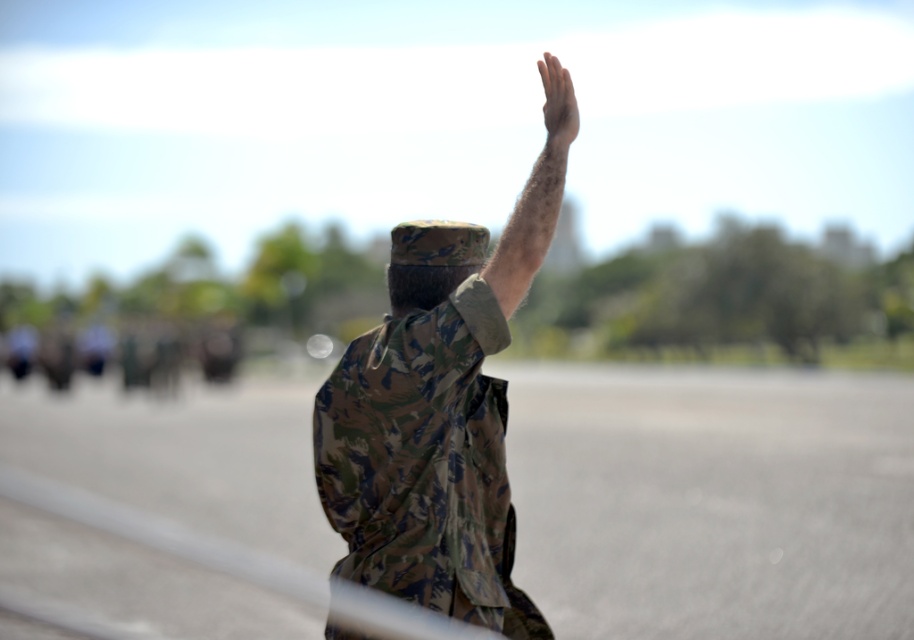
You are a photographer trying to capture a clear photo of the smooth skin hand at upper right and the hairy skin at upper center. Which one is easier to focus on due to its proximity to the camera?

The hairy skin at upper center is closer to the viewer than the smooth skin hand at upper right, so it is easier to focus on the hairy skin at upper center because it is nearer to the camera.

You are a photographer trying to capture a closeup shot of the hairy skin at upper center and the smooth skin hand at upper right. You need to adjust your camera focus to ensure both are in frame. Which object should you focus on first if you want to prioritize the wider one?

The hairy skin at upper center might be wider than the smooth skin hand at upper right, so you should focus on the hairy skin at upper center first to prioritize the wider object.

You are a photographer trying to capture a clear shot of the camo fabric uniform at center and the hairy skin at upper center. Which object should you focus on to ensure it appears larger in your photo?

The camo fabric uniform at center should be focused on because it has a greater height compared to the hairy skin at upper center, making it naturally appear larger in the photo.